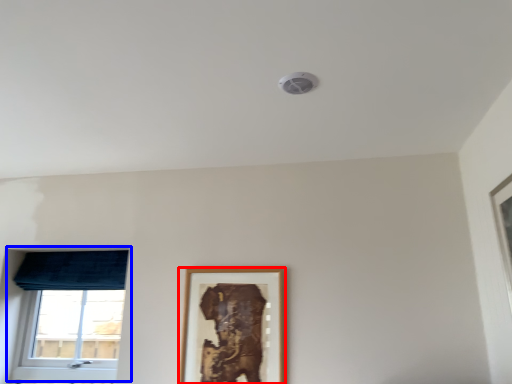
Question: Which point is closer to the camera, picture frame (highlighted by a red box) or window (highlighted by a blue box)?

Choices:
 (A) picture frame
 (B) window

Answer: (A)